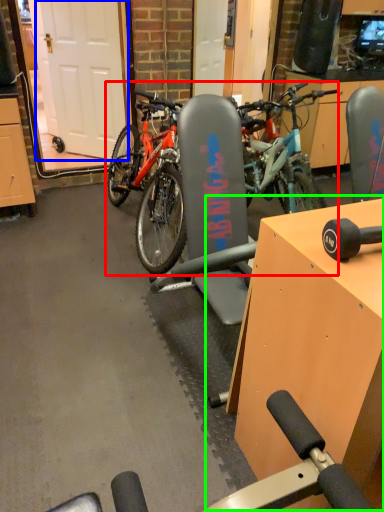
Question: Which object is positioned closest to bicycle (highlighted by a red box)? Select from garage door (highlighted by a blue box) and table (highlighted by a green box).

Choices:
 (A) garage door
 (B) table

Answer: (A)